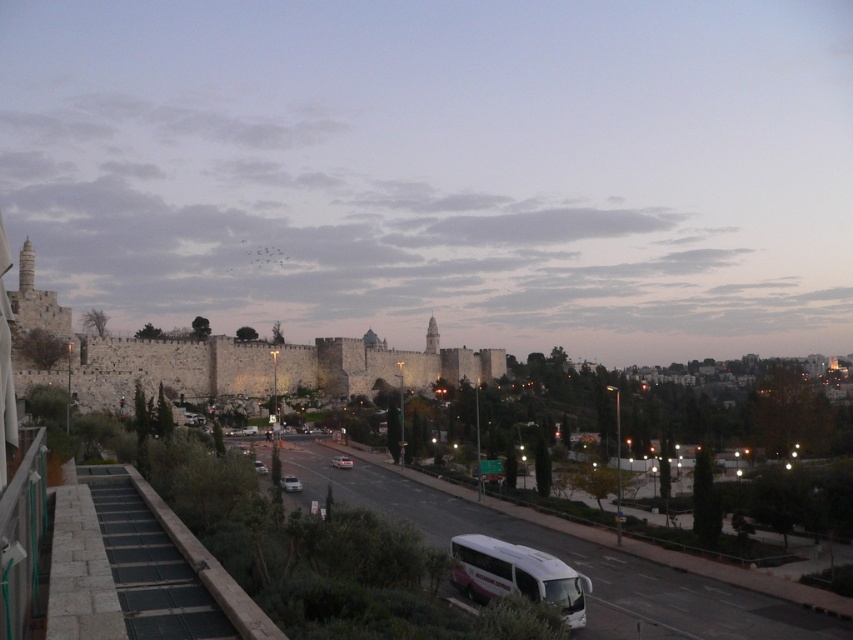
Is stone wall at center above white matte tour bus at lower center?

Yes.

Which is behind, point (325, 337) or point (566, 604)?

Point (325, 337)

This screenshot has height=640, width=853. I want to click on stone wall at center, so click(242, 358).

Between point (103, 394) and point (296, 486), which one is positioned in front?

Point (296, 486) is more forward.

Between point (256, 340) and point (300, 483), which one is positioned behind?

The point (256, 340) is more distant.

Between point (431, 330) and point (296, 477), which one is positioned in front?

Point (296, 477) is more forward.

Find the location of a particular element. The width and height of the screenshot is (853, 640). stone wall at center is located at coordinates (242, 358).

Does white glossy car at center have a smaller size compared to silver metallic car at lower center?

Indeed, white glossy car at center has a smaller size compared to silver metallic car at lower center.

Describe the element at coordinates (289, 483) in the screenshot. I see `white glossy car at center` at that location.

Identify the location of white glossy car at center. (289, 483).